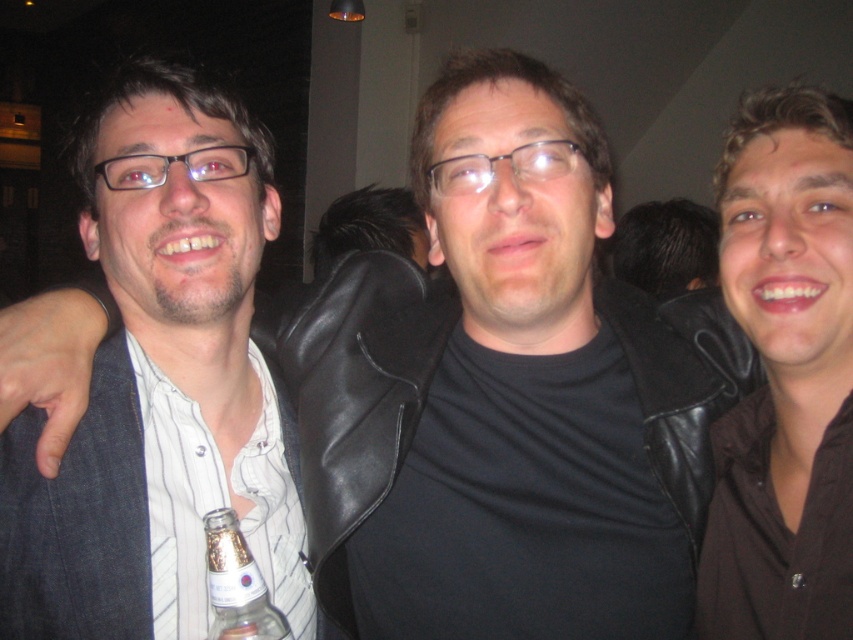
You are a photographer trying to adjust the lighting for a closeup shot of the glasses. Which pair of glasses at center has a smaller size, the clear plastic glasses at center or the matte black glasses at center?

The clear plastic glasses at center has a smaller size compared to matte black glasses at center, so the clear plastic glasses at center is the smaller one.

You are standing at the point labeled as point (483,179) and want to move towards the point labeled as point (241,621). Which direction should you move relative to your current position?

You should move towards the direction of point (241,621), which is in front of point (483,179).